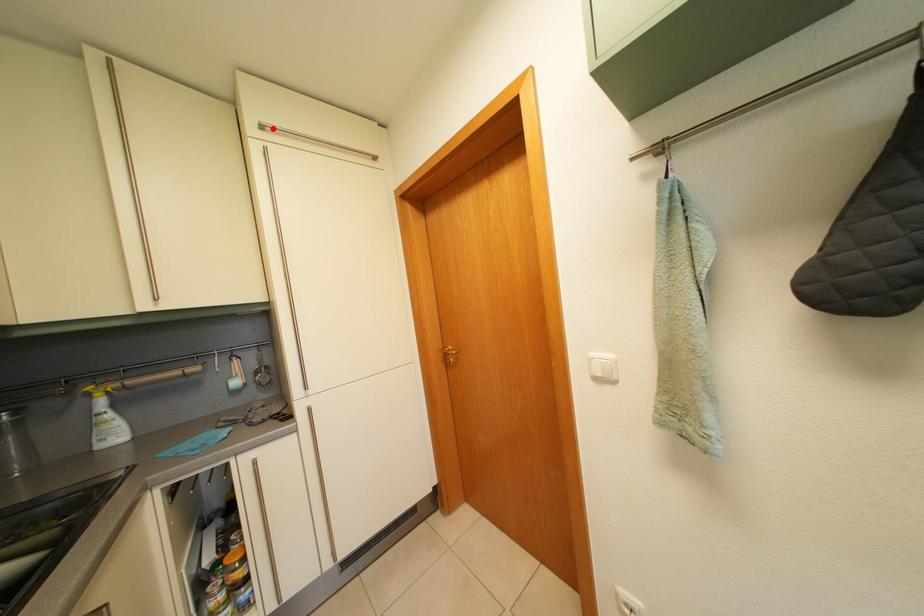
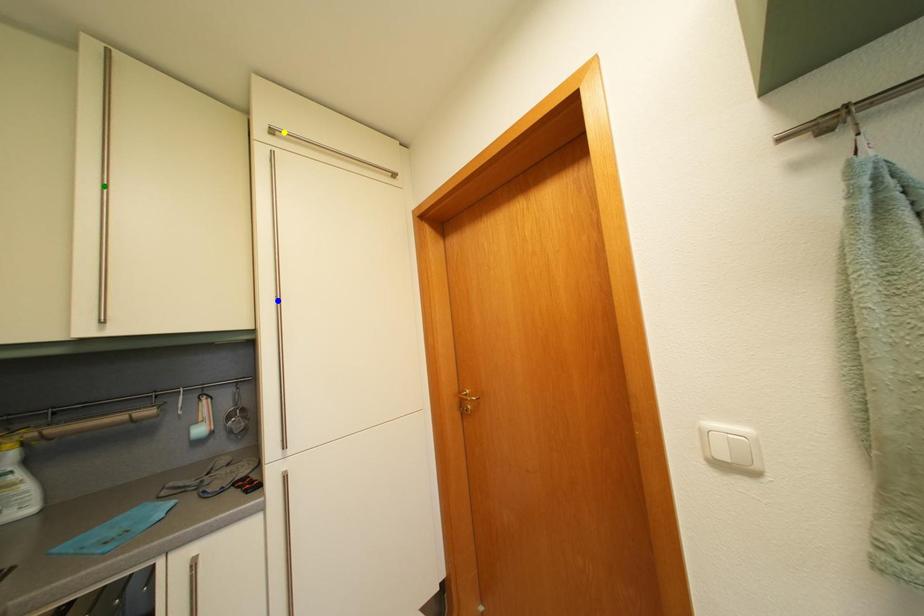
Question: I am providing you with two images of the same scene from different viewpoints. A red point is marked on the first image. You are given multiple points on the second image. Can you choose the point in image 2 that corresponds to the point in image 1?

Choices:
 (A) blue point
 (B) green point
 (C) yellow point

Answer: (C)